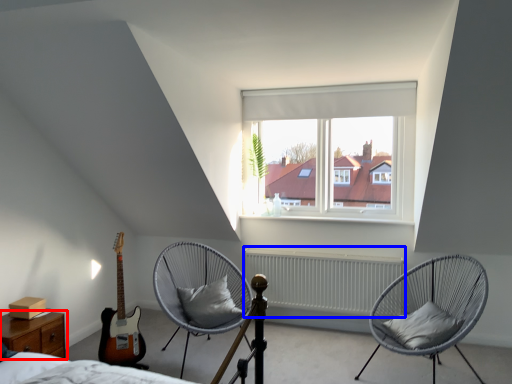
Question: Which object is closer to the camera taking this photo, nightstand (highlighted by a red box) or radiator (highlighted by a blue box)?

Choices:
 (A) nightstand
 (B) radiator

Answer: (A)